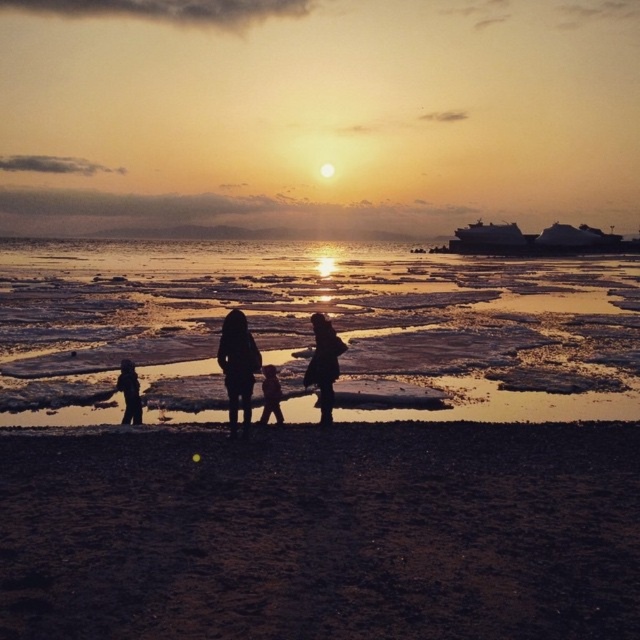
Question: Which of the following is the farthest from the observer?

Choices:
 (A) silhouette clothing at center
 (B) silhouette clothing at lower left
 (C) silhouette figure at center

Answer: (B)

Question: Is dark sand at lower center to the right of silhouette family at center from the viewer's perspective?

Choices:
 (A) yes
 (B) no

Answer: (B)

Question: Among these points, which one is farthest from the camera?

Choices:
 (A) (324, 352)
 (B) (611, 554)
 (C) (314, 365)

Answer: (C)

Question: Which point appears farthest from the camera in this image?

Choices:
 (A) (250, 364)
 (B) (154, 442)

Answer: (B)

Question: Can you confirm if dark sand at lower center is smaller than silhouette figure at center?

Choices:
 (A) yes
 (B) no

Answer: (B)

Question: Does translucent ice at center have a greater width compared to smooth skin child at center?

Choices:
 (A) no
 (B) yes

Answer: (B)